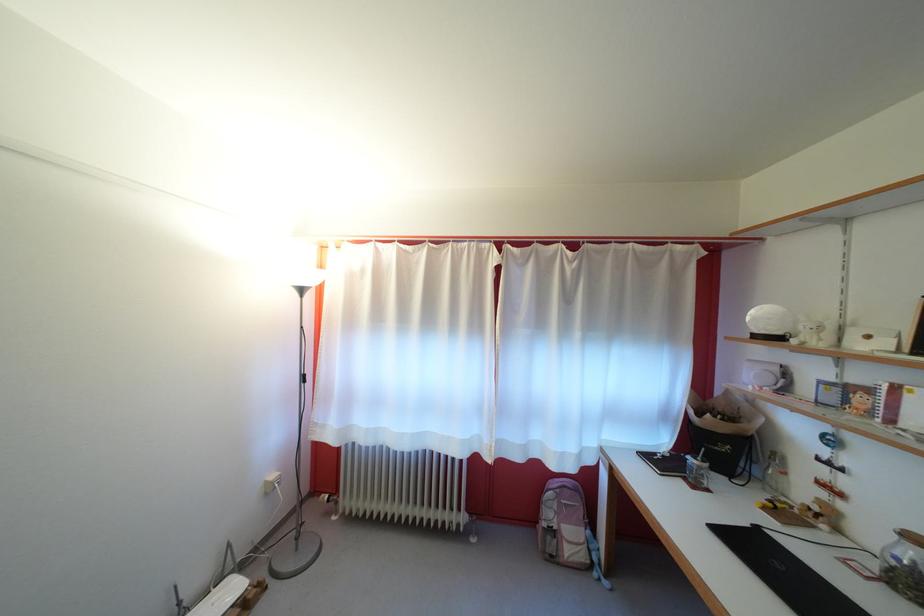
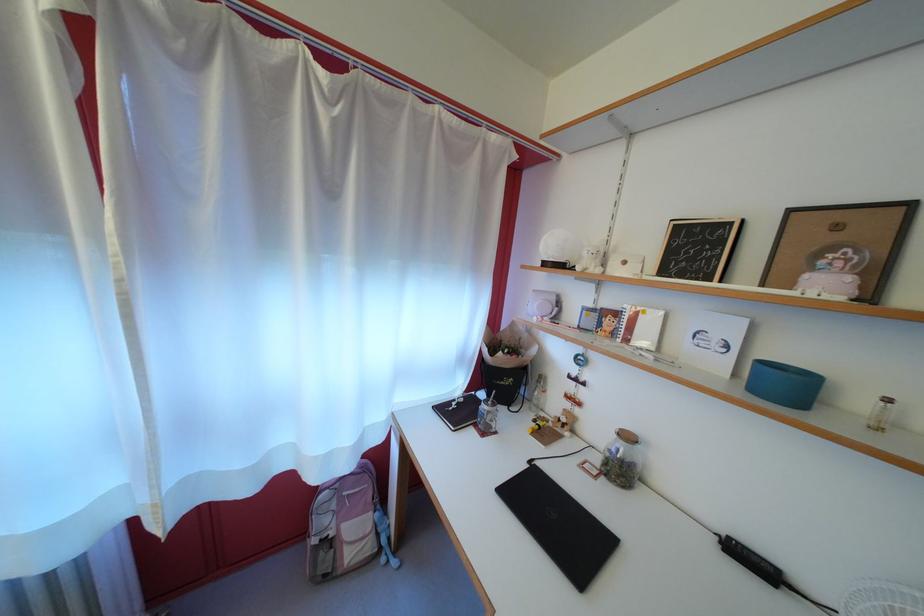
The point at (576,306) is marked in the first image. Where is the corresponding point in the second image?

(335, 193)